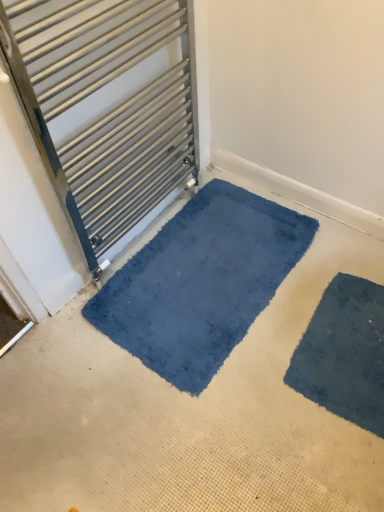
Locate an element on the screen. This screenshot has height=512, width=384. empty space that is ontop of blue soft carpet at center (from a real-world perspective) is located at coordinates (251, 291).